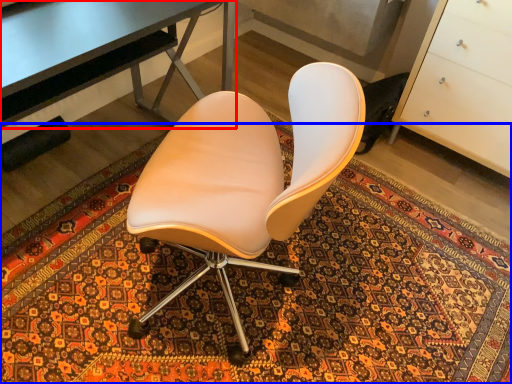
Question: Which point is further to the camera, desk (highlighted by a red box) or mat (highlighted by a blue box)?

Choices:
 (A) desk
 (B) mat

Answer: (A)